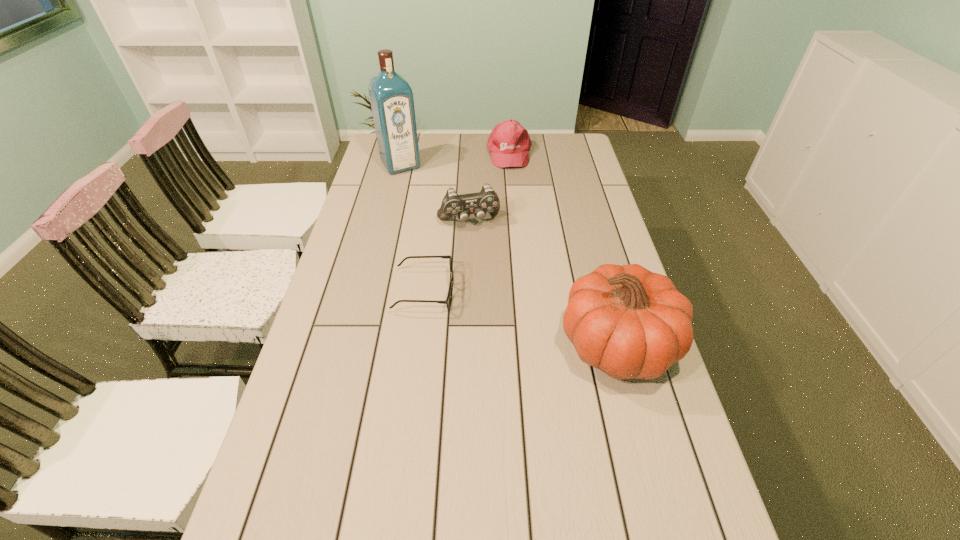
The height and width of the screenshot is (540, 960). In order to click on free point at the far edge in this screenshot , I will do `click(528, 133)`.

In order to click on free location at the left edge of the desktop in this screenshot , I will do `click(317, 475)`.

The image size is (960, 540). I want to click on vacant area at the right edge, so (579, 233).

Identify the location of vacant area at the far left corner. This screenshot has height=540, width=960. (375, 151).

Locate an element on the screen. empty space between the spectacles and the baseball cap is located at coordinates (467, 222).

Image resolution: width=960 pixels, height=540 pixels. I want to click on free space between the second tallest object and the spectacles, so click(521, 318).

Find the location of a particular element. vacant space in between the liquor and the baseball cap is located at coordinates (455, 159).

The height and width of the screenshot is (540, 960). What are the coordinates of `vacant point located between the pumpkin and the tallest object` in the screenshot? It's located at (509, 255).

Image resolution: width=960 pixels, height=540 pixels. What are the coordinates of `vacant point located between the tallest object and the spectacles` in the screenshot? It's located at (413, 228).

In order to click on free space that is in between the spectacles and the baseball cap in this screenshot , I will do `click(467, 222)`.